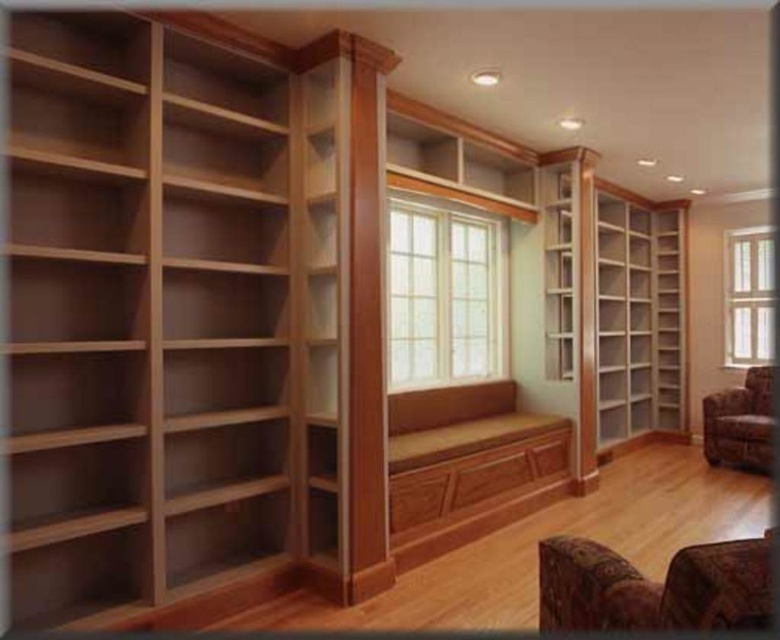
Question: Can you confirm if light brown wood bookshelf at right is positioned to the right of velvet floral armchair at lower right?

Choices:
 (A) yes
 (B) no

Answer: (B)

Question: Is brown patterned fabric armchair at lower right further to camera compared to velvet floral armchair at lower right?

Choices:
 (A) no
 (B) yes

Answer: (A)

Question: Which object is farther from the camera taking this photo?

Choices:
 (A) light brown wood bookshelf at right
 (B) velvet floral armchair at lower right
 (C) brown patterned fabric armchair at lower right
 (D) clear glass window at center

Answer: (A)

Question: Which object appears farthest from the camera in this image?

Choices:
 (A) light brown wood bookshelf at left
 (B) light brown wood bookshelf at right
 (C) clear glass window at center
 (D) clear glass window at right

Answer: (B)

Question: Which object is farther from the camera taking this photo?

Choices:
 (A) light brown wood bookshelf at left
 (B) light brown wood bookshelf at right
 (C) velvet floral armchair at lower right

Answer: (B)

Question: Can you confirm if light brown wood bookshelf at right is positioned to the right of velvet floral armchair at lower right?

Choices:
 (A) no
 (B) yes

Answer: (A)